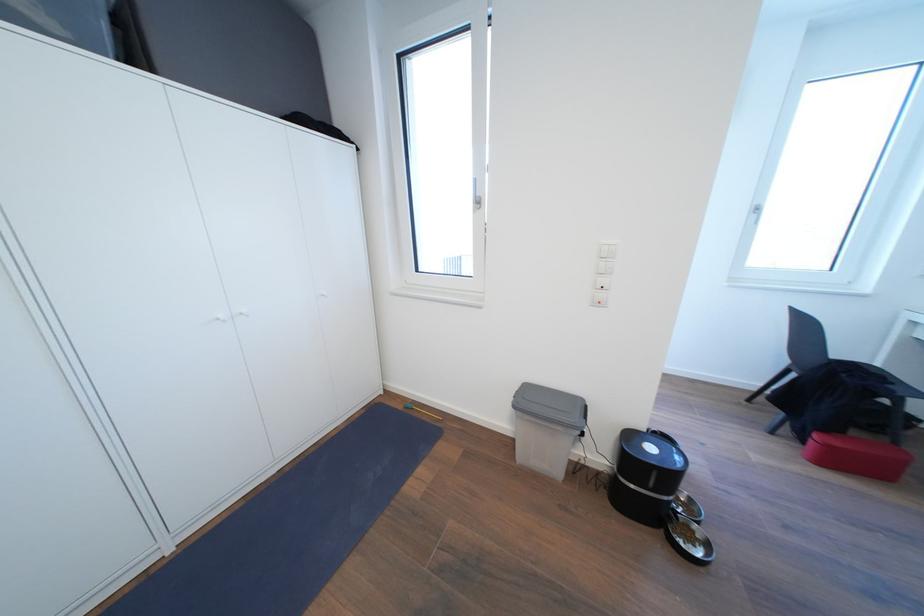
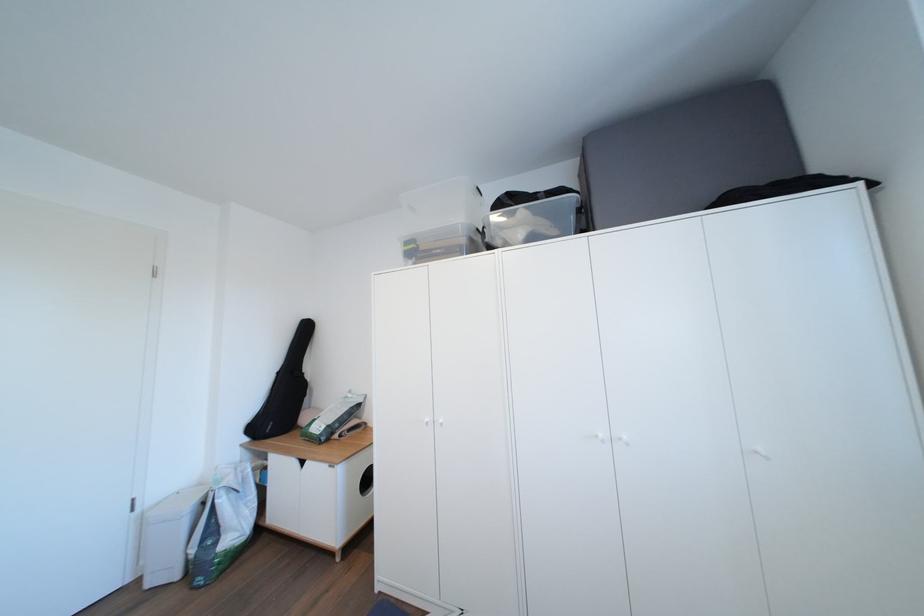
Question: How did the camera likely rotate?

Choices:
 (A) Left
 (B) Right
 (C) Up
 (D) Down

Answer: (A)